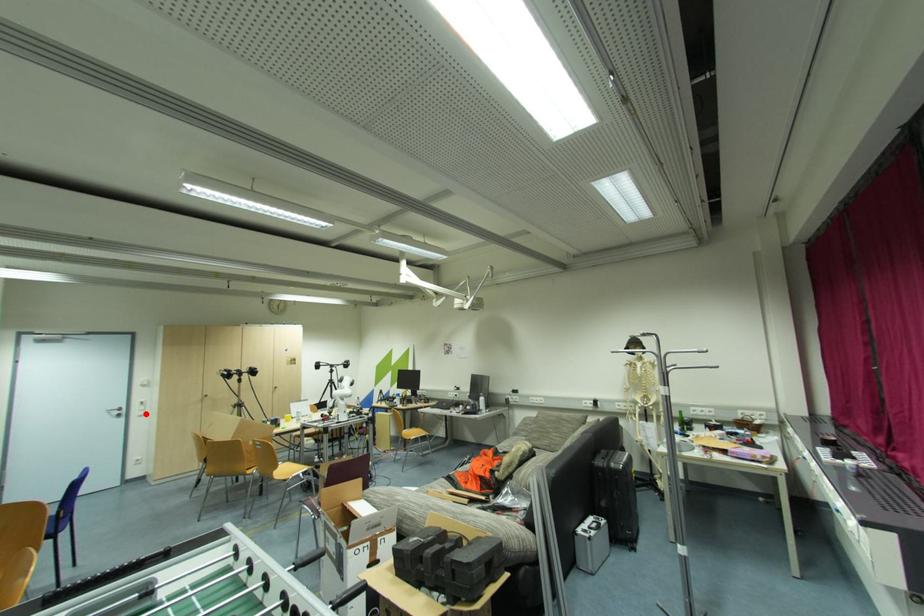
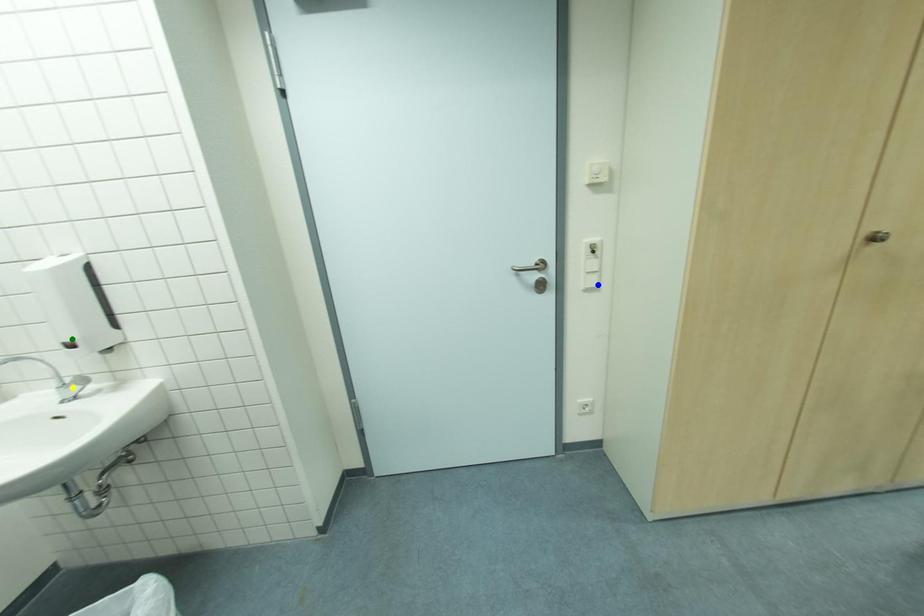
Question: I am providing you with two images of the same scene from different viewpoints. A red point is marked on the first image. You are given multiple points on the second image. Which point in image 2 is actually the same real-world point as the red point in image 1?

Choices:
 (A) blue point
 (B) yellow point
 (C) green point

Answer: (A)